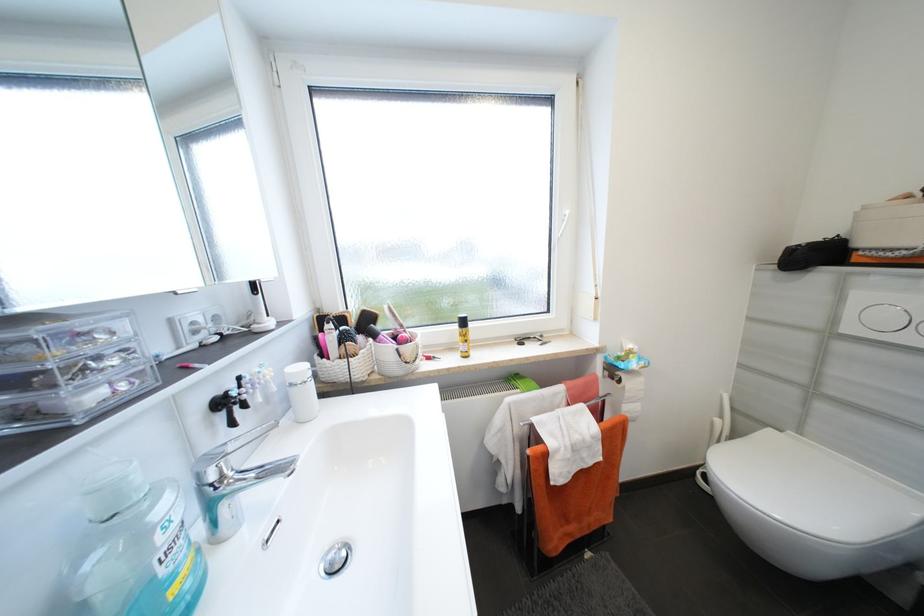
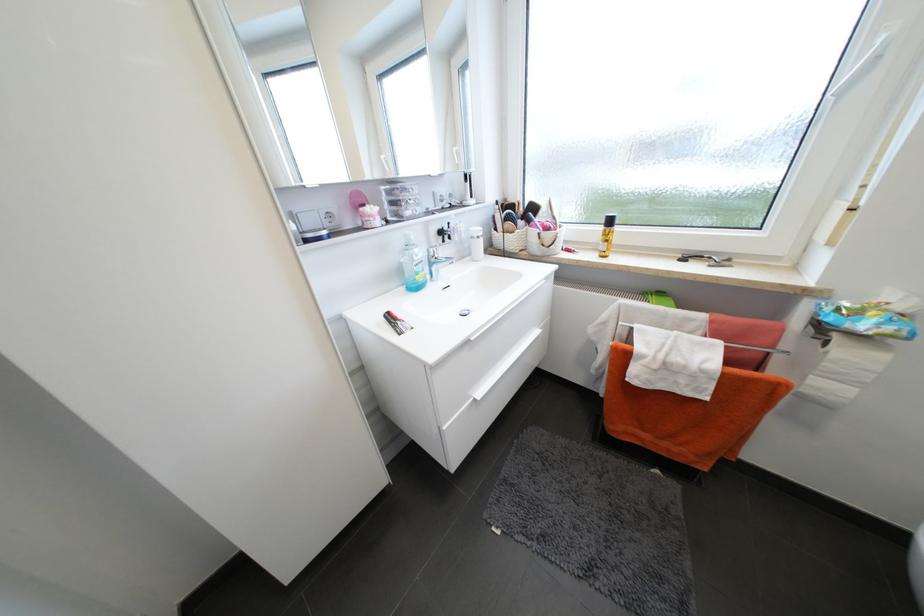
In the second image, find the point that corresponds to point (298, 386) in the first image.

(478, 238)